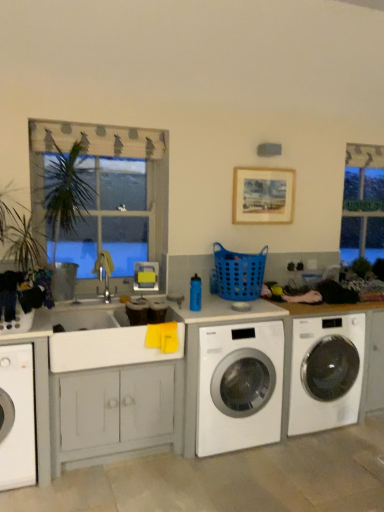
Where is `blue plastic basket at center`? blue plastic basket at center is located at coordinates (239, 273).

The width and height of the screenshot is (384, 512). Describe the element at coordinates (326, 372) in the screenshot. I see `white glossy washing machine at center, which appears as the first washing machine when viewed from the right` at that location.

Image resolution: width=384 pixels, height=512 pixels. In order to click on green glass sign at upper right in this screenshot , I will do `click(363, 203)`.

Can you confirm if white glossy washing machine at center, which is the second washing machine in right-to-left order, is positioned to the left of white glossy washing machine at center, the 3th washing machine in the left-to-right sequence?

Correct, you'll find white glossy washing machine at center, which is the second washing machine in right-to-left order, to the left of white glossy washing machine at center, the 3th washing machine in the left-to-right sequence.

Considering the positions of points (253, 400) and (328, 338), is point (253, 400) closer to camera compared to point (328, 338)?

Yes, point (253, 400) is closer to viewer.

Looking at this image, considering the sizes of objects white glossy washing machine at center, which is the second washing machine in left-to-right order, and white glossy washing machine at center, which appears as the first washing machine when viewed from the right, in the image provided, who is shorter, white glossy washing machine at center, which is the second washing machine in left-to-right order, or white glossy washing machine at center, which appears as the first washing machine when viewed from the right,?

With less height is white glossy washing machine at center, which is the second washing machine in left-to-right order.

Consider the image. Does white glossy washing machine at center, which is the second washing machine in right-to-left order, lie behind green glass sign at upper right?

No, white glossy washing machine at center, which is the second washing machine in right-to-left order, is closer to the viewer.

Considering the points (225, 428) and (376, 234), which point is in front, point (225, 428) or point (376, 234)?

The point (225, 428) is more forward.

Is white glossy washing machine at center, which is the second washing machine in right-to-left order, far from green glass sign at upper right?

white glossy washing machine at center, which is the second washing machine in right-to-left order, is positioned a significant distance from green glass sign at upper right.

Consider the image. Considering the sizes of white glossy washing machine at center, which is the second washing machine in left-to-right order, and green glass sign at upper right in the image, is white glossy washing machine at center, which is the second washing machine in left-to-right order, taller or shorter than green glass sign at upper right?

white glossy washing machine at center, which is the second washing machine in left-to-right order, is shorter than green glass sign at upper right.

Between point (159, 162) and point (323, 337), which one is positioned in front?

The point (159, 162) is in front.

Is wooden frame at upper left far away from white glossy washing machine at center, which appears as the first washing machine when viewed from the right?

Yes.

From a real-world perspective, is wooden frame at upper left beneath white glossy washing machine at center, the 3th washing machine in the left-to-right sequence?

Incorrect, from a real-world perspective, wooden frame at upper left is higher than white glossy washing machine at center, the 3th washing machine in the left-to-right sequence.

Is wooden frame at upper left positioned beyond the bounds of white glossy washing machine at center, the 3th washing machine in the left-to-right sequence?

Yes.

Is white glossy washing machine at lower left, the first washing machine in the left-to-right sequence, taller or shorter than green glass sign at upper right?

Considering their sizes, white glossy washing machine at lower left, the first washing machine in the left-to-right sequence, has less height than green glass sign at upper right.

Is the position of white glossy washing machine at lower left, the 3th washing machine in the right-to-left sequence, less distant than that of green glass sign at upper right?

Yes.

Does white glossy washing machine at lower left, the 3th washing machine in the right-to-left sequence, turn towards green glass sign at upper right?

No, white glossy washing machine at lower left, the 3th washing machine in the right-to-left sequence, does not turn towards green glass sign at upper right.

From a real-world perspective, is green glass sign at upper right beneath white glossy washing machine at center, which is the second washing machine in left-to-right order?

No, from a real-world perspective, green glass sign at upper right is not beneath white glossy washing machine at center, which is the second washing machine in left-to-right order.

Considering the positions of point (353, 157) and point (262, 350), is point (353, 157) closer or farther from the camera than point (262, 350)?

Point (353, 157).

Looking at the image, does green glass sign at upper right seem bigger or smaller compared to white glossy washing machine at center, which is the second washing machine in right-to-left order?

In the image, green glass sign at upper right appears to be smaller than white glossy washing machine at center, which is the second washing machine in right-to-left order.

Considering the relative sizes of green glass sign at upper right and white glossy washing machine at center, which is the second washing machine in right-to-left order, in the image provided, is green glass sign at upper right thinner than white glossy washing machine at center, which is the second washing machine in right-to-left order,?

Yes.

Consider the image. Can you confirm if white glossy washing machine at center, which appears as the first washing machine when viewed from the right, is taller than white glossy washing machine at lower left, the 3th washing machine in the right-to-left sequence?

Indeed, white glossy washing machine at center, which appears as the first washing machine when viewed from the right, has a greater height compared to white glossy washing machine at lower left, the 3th washing machine in the right-to-left sequence.

What's the angular difference between white glossy washing machine at center, which appears as the first washing machine when viewed from the right, and white glossy washing machine at lower left, the 3th washing machine in the right-to-left sequence,'s facing directions?

The facing directions of white glossy washing machine at center, which appears as the first washing machine when viewed from the right, and white glossy washing machine at lower left, the 3th washing machine in the right-to-left sequence, are 9.64e-05 degrees apart.

Which object is positioned more to the right, white glossy washing machine at center, the 3th washing machine in the left-to-right sequence, or white glossy washing machine at lower left, the first washing machine in the left-to-right sequence?

white glossy washing machine at center, the 3th washing machine in the left-to-right sequence.

Would you say white glossy washing machine at lower left, the 3th washing machine in the right-to-left sequence, is part of white glossy washing machine at center, which appears as the first washing machine when viewed from the right,'s contents?

That's incorrect, white glossy washing machine at lower left, the 3th washing machine in the right-to-left sequence, is not inside white glossy washing machine at center, which appears as the first washing machine when viewed from the right.

Is white glossy washing machine at lower left, the first washing machine in the left-to-right sequence, aimed at blue plastic basket at center?

No, white glossy washing machine at lower left, the first washing machine in the left-to-right sequence, is not turned towards blue plastic basket at center.

From a real-world perspective, is white glossy washing machine at lower left, the 3th washing machine in the right-to-left sequence, physically above blue plastic basket at center?

No, from a real-world perspective, white glossy washing machine at lower left, the 3th washing machine in the right-to-left sequence, is not above blue plastic basket at center.

Does white glossy washing machine at lower left, the 3th washing machine in the right-to-left sequence, lie behind blue plastic basket at center?

No, white glossy washing machine at lower left, the 3th washing machine in the right-to-left sequence, is closer to the viewer.

You are a GUI agent. You are given a task and a screenshot of the screen. Output one action in this format:
    pyautogui.click(x=<x>, y=<y>)
    Task: Click on the washing machine behind the white glossy washing machine at center, which is the second washing machine in left-to-right order
    This screenshot has height=512, width=384.
    Given the screenshot: What is the action you would take?
    pyautogui.click(x=326, y=372)

The image size is (384, 512). In order to click on the 2nd washing machine in front of the green glass sign at upper right in this screenshot , I will do `click(239, 386)`.

In the scene shown: Based on their spatial positions, is white glossy washing machine at center, which appears as the first washing machine when viewed from the right, or green glass sign at upper right closer to wooden frame at upper left?

white glossy washing machine at center, which appears as the first washing machine when viewed from the right, is positioned closer to the anchor wooden frame at upper left.

From the image, which object appears to be farther from wooden framed artwork at upper center, white glossy washing machine at lower left, the 3th washing machine in the right-to-left sequence, or white glossy washing machine at center, which appears as the first washing machine when viewed from the right?

white glossy washing machine at lower left, the 3th washing machine in the right-to-left sequence, is further to wooden framed artwork at upper center.

When comparing their distances from white glossy washing machine at center, which is the second washing machine in right-to-left order, does wooden framed artwork at upper center or wooden frame at upper left seem further?

wooden framed artwork at upper center is positioned further to the anchor white glossy washing machine at center, which is the second washing machine in right-to-left order.

Based on their spatial positions, is wooden framed artwork at upper center or white glossy washing machine at center, the 3th washing machine in the left-to-right sequence, further from white glossy washing machine at center, which is the second washing machine in right-to-left order?

wooden framed artwork at upper center lies further to white glossy washing machine at center, which is the second washing machine in right-to-left order, than the other object.

Which object lies further to the anchor point wooden framed artwork at upper center, white glossy washing machine at center, which appears as the first washing machine when viewed from the right, or blue plastic basket at center?

white glossy washing machine at center, which appears as the first washing machine when viewed from the right, is further to wooden framed artwork at upper center.

Looking at the image, which one is located closer to white glossy washing machine at center, which is the second washing machine in left-to-right order, blue plastic basket at center or wooden framed artwork at upper center?

blue plastic basket at center lies closer to white glossy washing machine at center, which is the second washing machine in left-to-right order, than the other object.

Considering their positions, is white glossy washing machine at center, the 3th washing machine in the left-to-right sequence, positioned closer to blue plastic basket at center than wooden framed artwork at upper center?

Based on the image, wooden framed artwork at upper center appears to be nearer to blue plastic basket at center.

Based on their spatial positions, is blue plastic basket at center or white glossy washing machine at lower left, the first washing machine in the left-to-right sequence, closer to white glossy washing machine at center, which is the second washing machine in left-to-right order?

blue plastic basket at center is closer to white glossy washing machine at center, which is the second washing machine in left-to-right order.

Find the location of `basket situated between white glossy washing machine at lower left, the 3th washing machine in the right-to-left sequence, and white glossy washing machine at center, which appears as the first washing machine when viewed from the right, from left to right`. basket situated between white glossy washing machine at lower left, the 3th washing machine in the right-to-left sequence, and white glossy washing machine at center, which appears as the first washing machine when viewed from the right, from left to right is located at coordinates (239, 273).

Identify the location of washing machine situated between white glossy washing machine at lower left, the 3th washing machine in the right-to-left sequence, and blue plastic basket at center from left to right. This screenshot has width=384, height=512. click(239, 386).

Locate an element on the screen. The height and width of the screenshot is (512, 384). washing machine located between white glossy washing machine at lower left, the first washing machine in the left-to-right sequence, and white glossy washing machine at center, which appears as the first washing machine when viewed from the right, in the left-right direction is located at coordinates (239, 386).

Locate an element on the screen. This screenshot has width=384, height=512. bay window that lies between wooden framed artwork at upper center and white glossy washing machine at center, the 3th washing machine in the left-to-right sequence, from top to bottom is located at coordinates (363, 203).